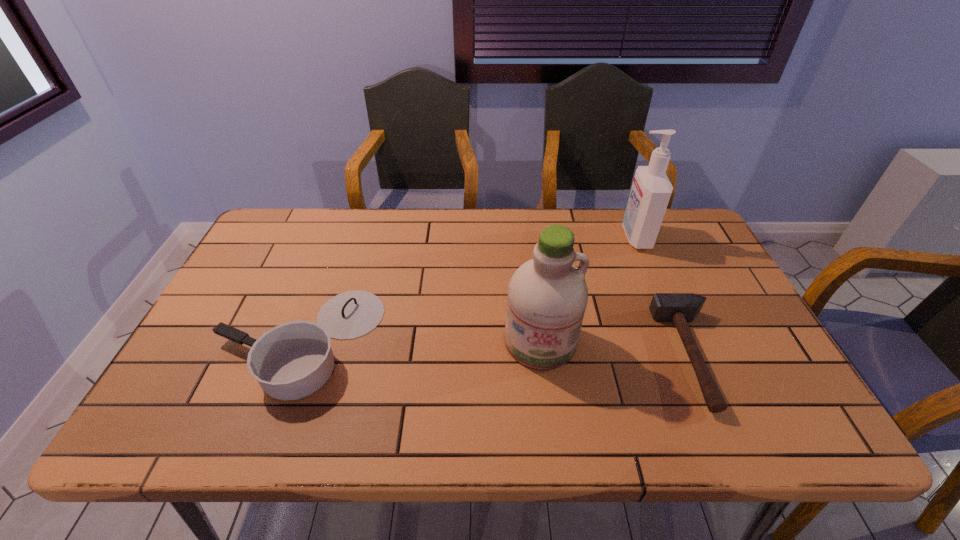
Locate an element on the screen. This screenshot has height=540, width=960. free space in the image that satisfies the following two spatial constraints: 1. on the front label of the right cleansing agent; 2. on the front label of the nearer cleansing agent is located at coordinates (680, 341).

The height and width of the screenshot is (540, 960). In order to click on vacant area in the image that satisfies the following two spatial constraints: 1. on the front label of the farthest object; 2. on the front label of the left cleansing agent in this screenshot , I will do `click(680, 341)`.

This screenshot has height=540, width=960. I want to click on vacant region that satisfies the following two spatial constraints: 1. on the front label of the farthest object; 2. on the front side of the saucepan, so click(680, 341).